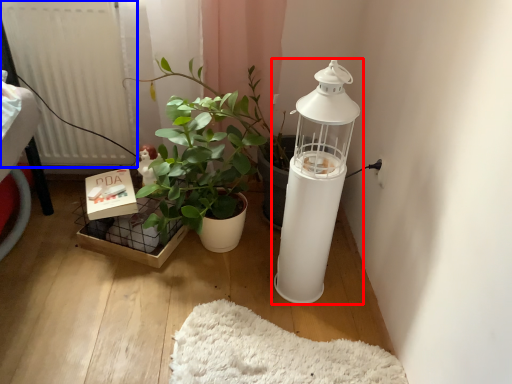
Question: Which object appears farthest to the camera in this image, lamp (highlighted by a red box) or radiator (highlighted by a blue box)?

Choices:
 (A) lamp
 (B) radiator

Answer: (B)